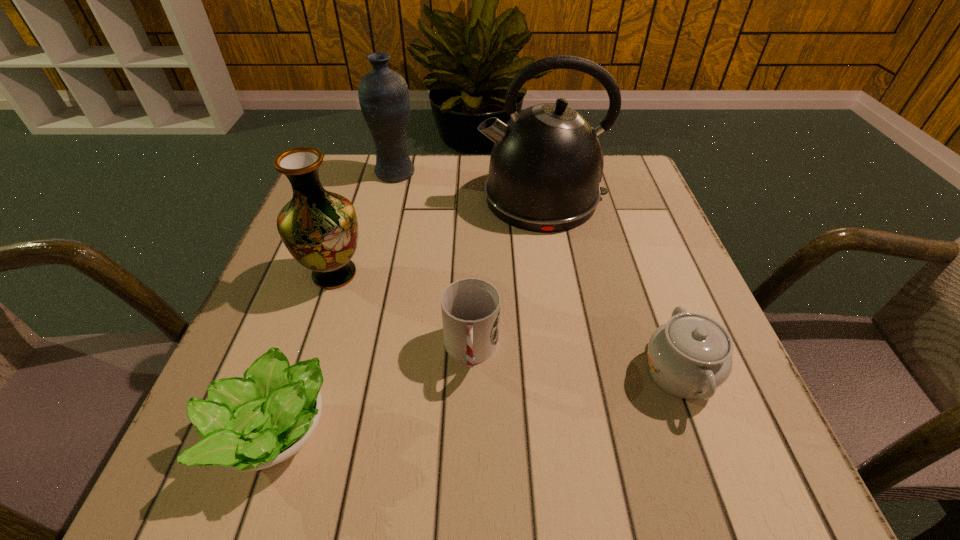
In order to click on free spot between the farther vase and the kettle in this screenshot , I will do `click(468, 185)`.

This screenshot has width=960, height=540. What are the coordinates of `free area in between the farther vase and the nearer vase` in the screenshot? It's located at (365, 223).

Where is `free area in between the cup and the farther vase`? The width and height of the screenshot is (960, 540). free area in between the cup and the farther vase is located at coordinates coord(434,262).

The width and height of the screenshot is (960, 540). I want to click on vacant area that lies between the third farthest object and the cup, so click(x=403, y=313).

Locate an element on the screen. unoccupied area between the farther vase and the nearer vase is located at coordinates (365, 223).

This screenshot has height=540, width=960. I want to click on vacant area that lies between the fourth nearest object and the kettle, so click(439, 236).

Locate an element on the screen. The height and width of the screenshot is (540, 960). vacant area that lies between the chinaware and the fourth nearest object is located at coordinates (507, 323).

The image size is (960, 540). Find the location of `free spot between the farther vase and the lettuce`. free spot between the farther vase and the lettuce is located at coordinates (335, 300).

Find the location of a particular element. Image resolution: width=960 pixels, height=540 pixels. empty space between the cup and the lettuce is located at coordinates (372, 390).

Identify which object is the third nearest to the kettle. Please provide its 2D coordinates. Your answer should be formatted as a tuple, i.e. [(x, y)], where the tuple contains the x and y coordinates of a point satisfying the conditions above.

[(470, 307)]